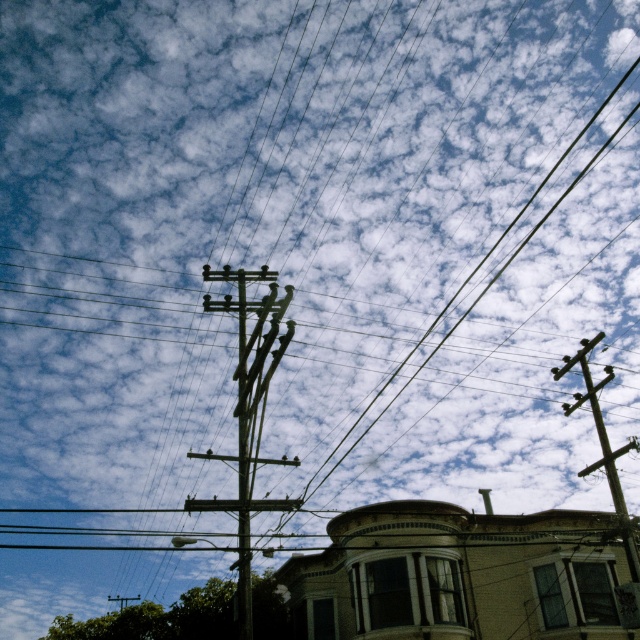
Is wooden telephone pole at center smaller than brown wooden telegraph pole at upper right?

No, wooden telephone pole at center is not smaller than brown wooden telegraph pole at upper right.

Does wooden telephone pole at center lie in front of brown wooden telegraph pole at upper right?

Yes, wooden telephone pole at center is closer to the viewer.

Between point (237, 445) and point (618, 488), which one is positioned in front?

Point (618, 488)

This screenshot has width=640, height=640. Find the location of `wooden telephone pole at center`. wooden telephone pole at center is located at coordinates (248, 412).